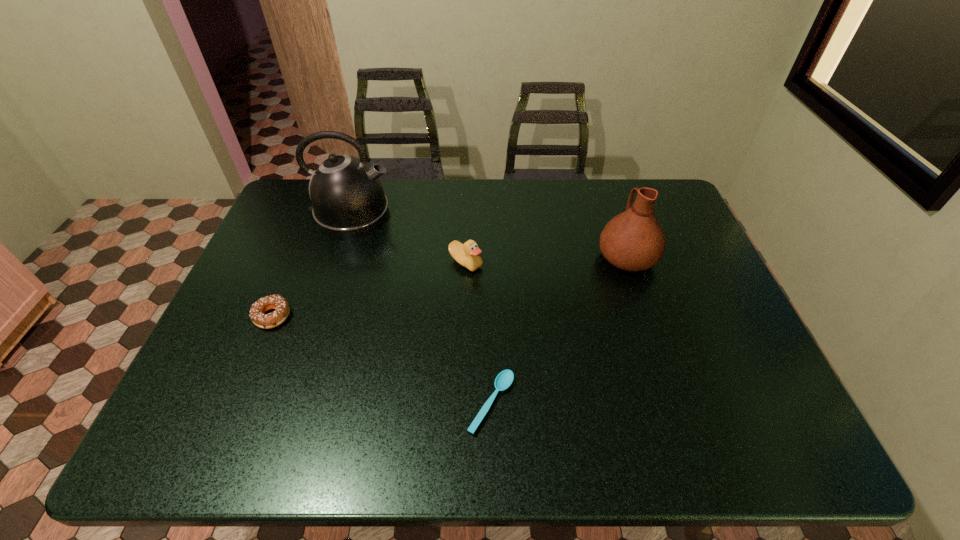
The height and width of the screenshot is (540, 960). I want to click on the tallest object, so click(x=347, y=196).

Identify the location of the rightmost object. (633, 240).

In order to click on the second tallest object in this screenshot , I will do `click(633, 240)`.

The image size is (960, 540). What are the coordinates of `duck` in the screenshot? It's located at (467, 254).

Find the location of a particular element. This screenshot has height=540, width=960. the fourth tallest object is located at coordinates (257, 311).

Identify the location of doughnut. The width and height of the screenshot is (960, 540). (257, 311).

Identify the location of the shortest object. (504, 379).

Find the location of a particular element. The width and height of the screenshot is (960, 540). spoon is located at coordinates (504, 379).

Find the location of `vacant space located 0.170m on the spout of the tallest object`. vacant space located 0.170m on the spout of the tallest object is located at coordinates (444, 213).

Find the location of a particular element. The width and height of the screenshot is (960, 540). free space located on the side of the pitcher with the handle is located at coordinates (616, 225).